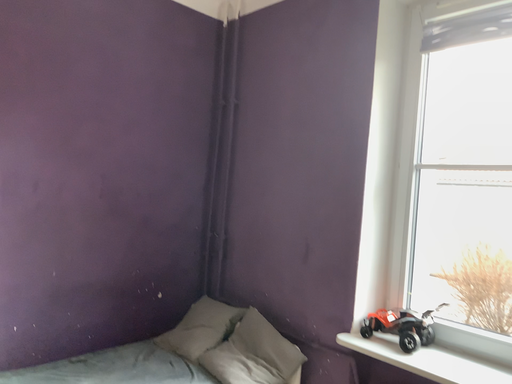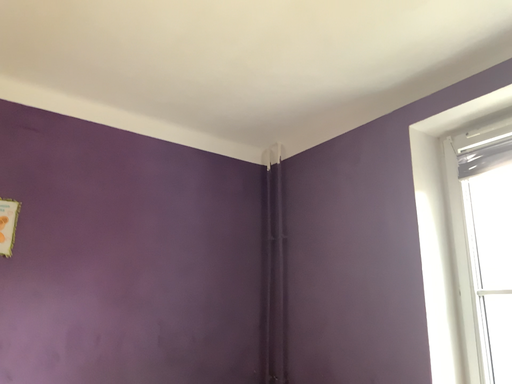
Question: Which way did the camera rotate in the video?

Choices:
 (A) rotated downward
 (B) rotated upward

Answer: (B)